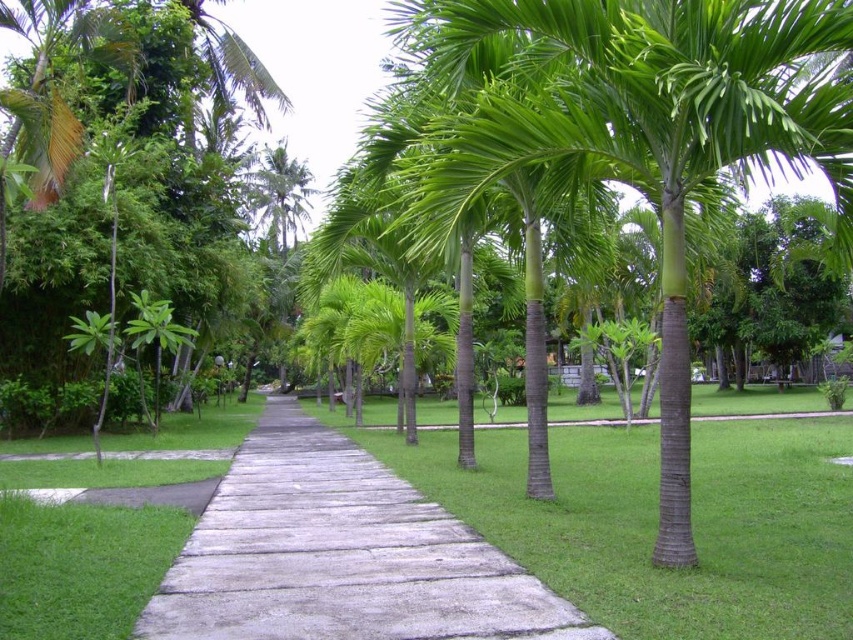
You are a gardener planning to mow the green grass at center and the gray concrete pavement at center. Which area should you mow first if you want to start from the closest point to you?

The green grass at center is in front of the gray concrete pavement at center, so you should mow the green grass at center first since it is closer to you.

You are planning to place a large garden statue that requires a stable base. Given the image, which object between the green grass at center and the gray concrete pavement at center would be more suitable for placing the statue?

The gray concrete pavement at center is more suitable for placing the statue as it provides a stable base, while the green grass at center has a larger size but may not offer the necessary stability.

You are standing at the starting point of the pathway in the tropical garden. You see two points marked on the path ahead of you. The first point is at coordinates point (610,600) and the second is at point (305,502). If you walk straight along the path, which point will you reach first?

You will reach point (610,600) first because it is closer to the camera than point (305,502), meaning it is nearer to your current position.